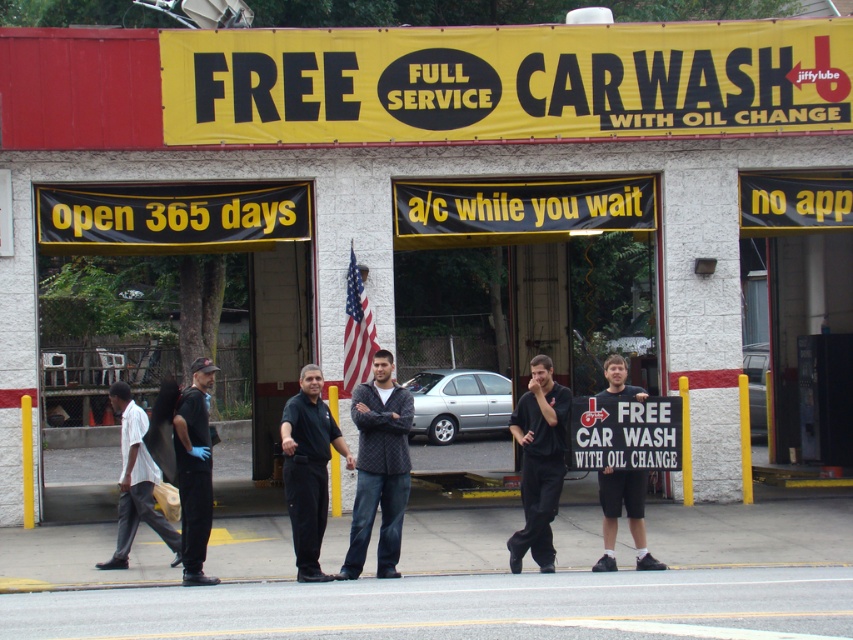
You are a customer approaching the car wash entrance and see two employees wearing the quilted sweater at center and the black matte shirt at center. Which employee is standing to the right of the other?

The quilted sweater at center is positioned on the right side of black matte shirt at center, so the employee wearing the quilted sweater at center is standing to the right of the one in the black matte shirt at center.

You are a customer approaching the car wash and see two employees wearing the black matte shirt at center and the dark blue uniform at center. Which employee is wearing a taller shirt?

The black matte shirt at center is taller than the dark blue uniform at center.